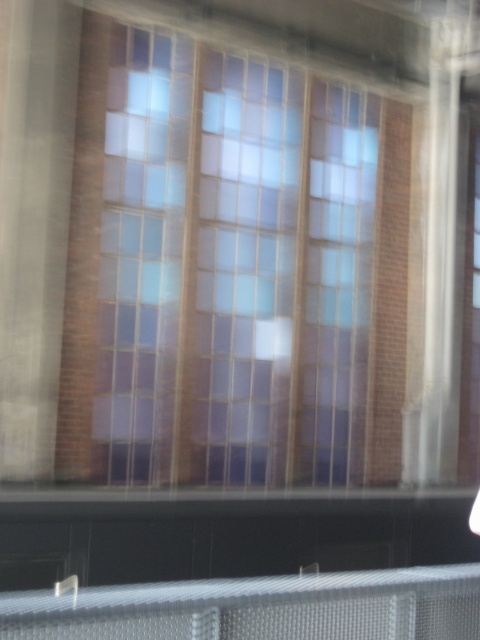
Measure the distance between blue glass window at center and metallic mesh fence at lower center.

blue glass window at center is 16.44 feet away from metallic mesh fence at lower center.

Can you confirm if blue glass window at center is smaller than metallic mesh fence at lower center?

No.

Between point (206, 470) and point (276, 628), which one is positioned in front?

Point (276, 628) is more forward.

I want to click on blue glass window at center, so click(231, 269).